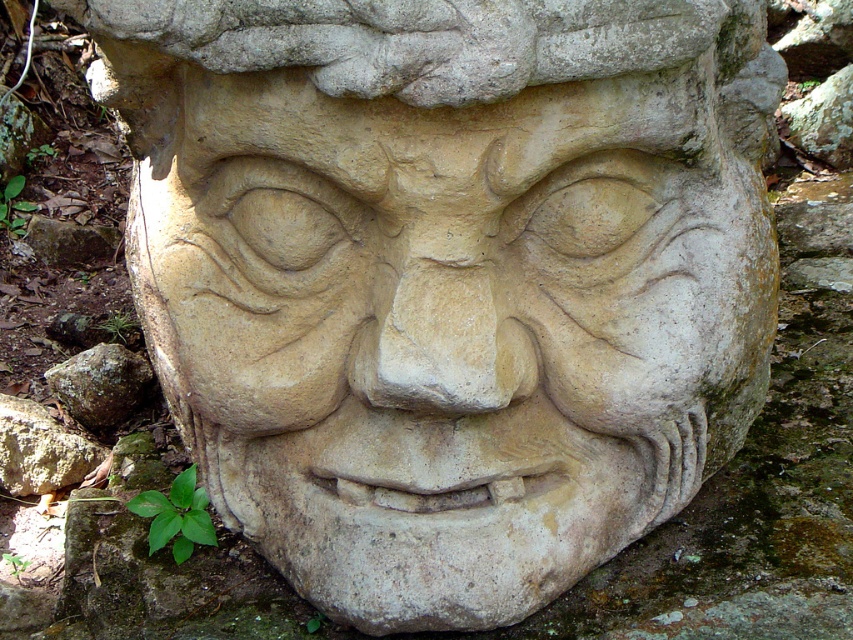
Who is positioned more to the left, gray stone at lower left or brown rough rock at lower left?

gray stone at lower left

Who is more forward, (20, 410) or (138, 371)?

Point (20, 410) is in front.

I want to click on gray stone at lower left, so click(39, 449).